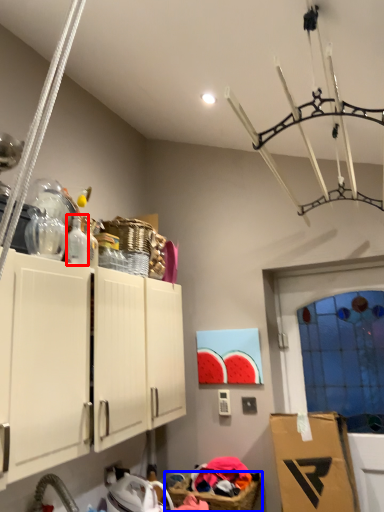
Question: Among these objects, which one is nearest to the camera, bottle (highlighted by a red box) or basket (highlighted by a blue box)?

Choices:
 (A) bottle
 (B) basket

Answer: (A)